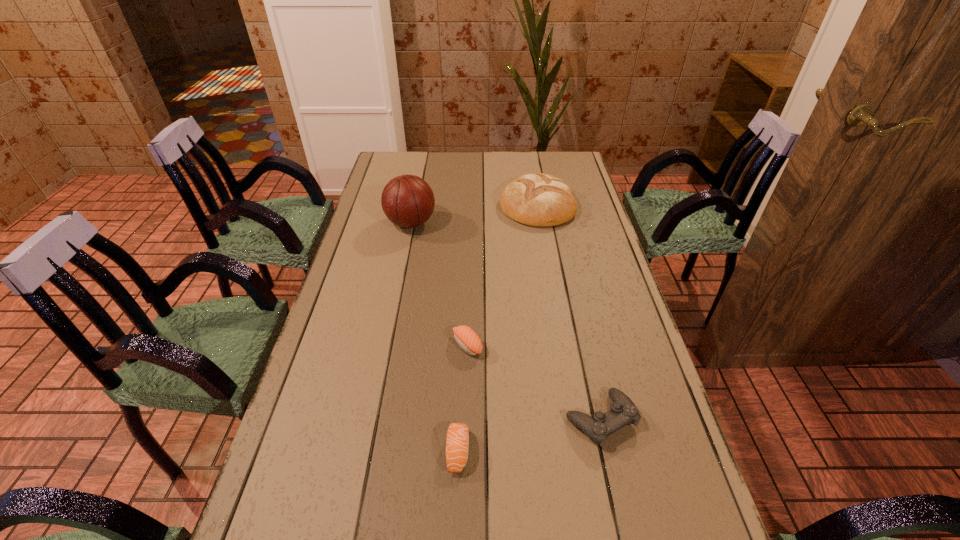
What are the coordinates of `object that is the closest to the leftmost object` in the screenshot? It's located at (539, 199).

Where is `object that is the third closest to the nearer sushi`? This screenshot has width=960, height=540. object that is the third closest to the nearer sushi is located at coordinates (408, 201).

I want to click on free space that satisfies the following two spatial constraints: 1. on the front side of the basketball; 2. on the right side of the nearer sushi, so click(365, 451).